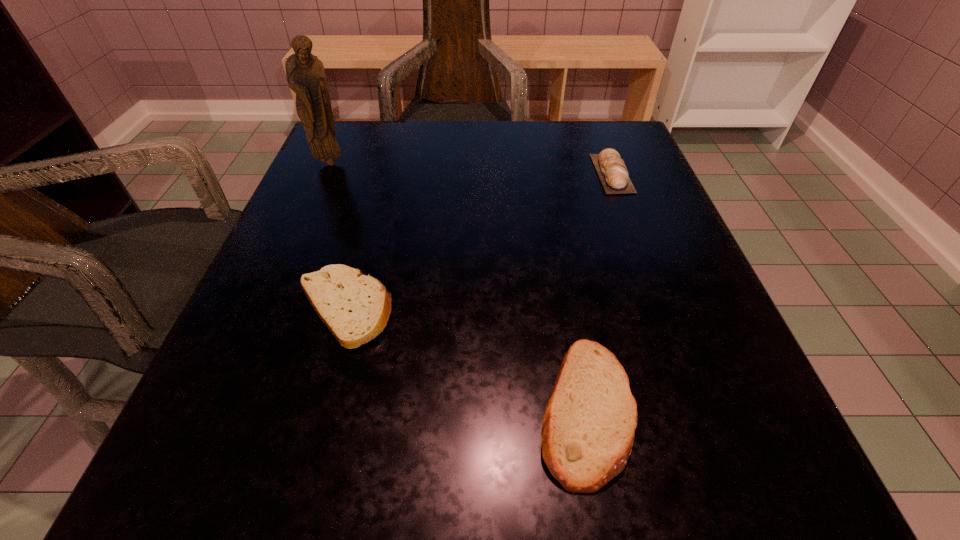
The height and width of the screenshot is (540, 960). Identify the location of vacant area that lies between the tallest object and the shortest pita bread. (337, 236).

At what (x,y) coordinates should I click in order to perform the action: click on free space between the second object from right to left and the second object from left to right. Please return your answer as a coordinate pair (x, y). The image size is (960, 540). Looking at the image, I should click on (465, 359).

Where is `vacant area that lies between the farthest pita bread and the second object from right to left`? This screenshot has width=960, height=540. vacant area that lies between the farthest pita bread and the second object from right to left is located at coordinates (599, 291).

Locate an element on the screen. unoccupied position between the third object from left to right and the shortest pita bread is located at coordinates [x=465, y=359].

Where is `object that is the nearest to the leftmost pita bread`? This screenshot has height=540, width=960. object that is the nearest to the leftmost pita bread is located at coordinates (589, 424).

Select which object is the closest to the third object from left to right. Please provide its 2D coordinates. Your answer should be formatted as a tuple, i.e. [(x, y)], where the tuple contains the x and y coordinates of a point satisfying the conditions above.

[(356, 308)]

Locate an element on the screen. Image resolution: width=960 pixels, height=540 pixels. pita bread object that ranks as the second closest to the farthest pita bread is located at coordinates (356, 308).

Find the location of `pita bread that can be found as the closest to the shortest pita bread`. pita bread that can be found as the closest to the shortest pita bread is located at coordinates pyautogui.click(x=589, y=424).

You are a GUI agent. You are given a task and a screenshot of the screen. Output one action in this format:
    pyautogui.click(x=<x>, y=<y>)
    Task: Click on the vacant position in the image that satisfies the following two spatial constraints: 1. on the back side of the farthest pita bread; 2. on the right side of the shortest object
    The width and height of the screenshot is (960, 540).
    Given the screenshot: What is the action you would take?
    pyautogui.click(x=382, y=173)

This screenshot has height=540, width=960. I want to click on free space that satisfies the following two spatial constraints: 1. on the front-facing side of the third object from right to left; 2. on the right side of the tallest object, so click(x=266, y=309).